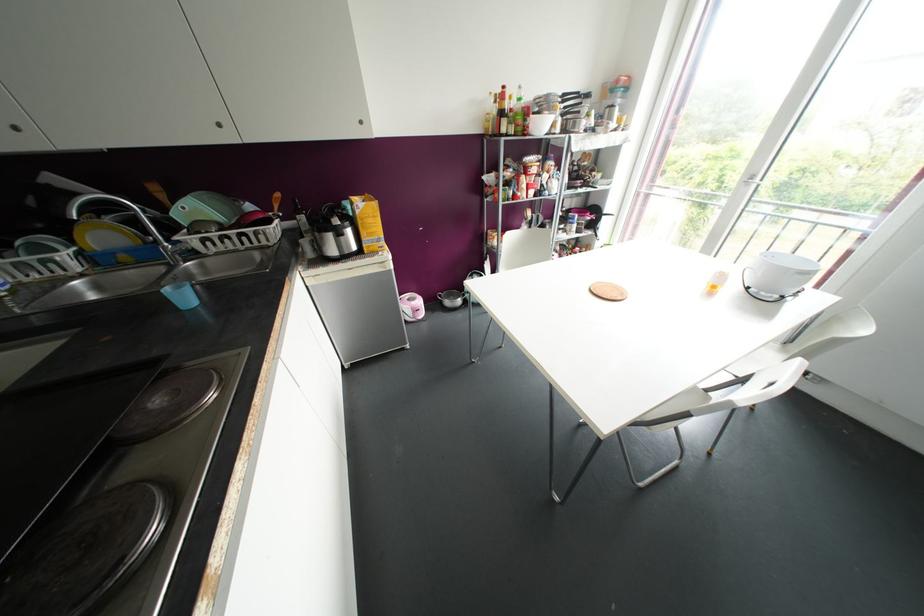
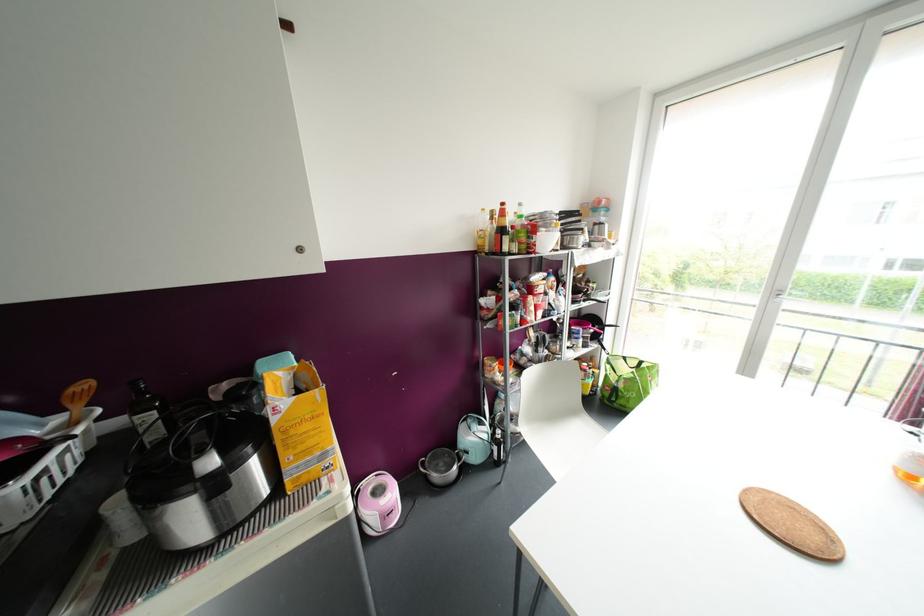
Locate, in the second image, the point that corresponds to point (301, 217) in the first image.

(150, 416)